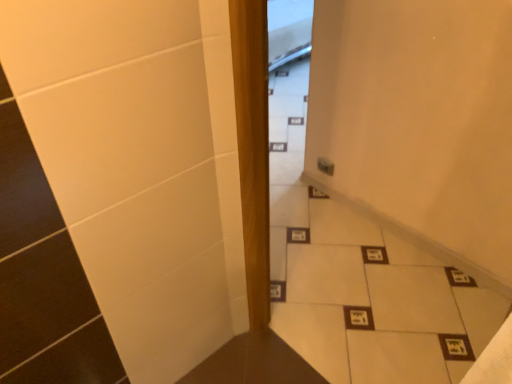
Question: Should I look upward or downward to see white tile stairwell at center?

Choices:
 (A) down
 (B) up

Answer: (A)